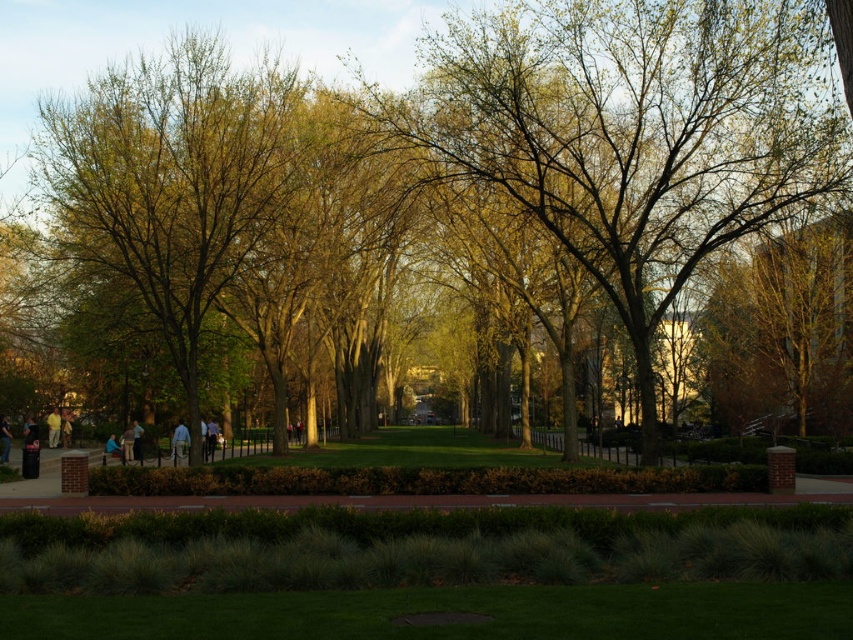
Question: Among these points, which one is farthest from the camera?

Choices:
 (A) (27, 436)
 (B) (77, 176)

Answer: (B)

Question: Does green leafy tree at center have a smaller size compared to dark blue jeans at lower left?

Choices:
 (A) no
 (B) yes

Answer: (A)

Question: Is green leafy tree at left wider than yellow cotton shirt at lower left?

Choices:
 (A) yes
 (B) no

Answer: (A)

Question: Does green leafy tree at left appear over red brick path at center?

Choices:
 (A) yes
 (B) no

Answer: (A)

Question: Which object appears farthest from the camera in this image?

Choices:
 (A) dark blue jeans at lower left
 (B) green leafy tree at left
 (C) green leafy tree at center

Answer: (A)

Question: Among these points, which one is nearest to the camera?

Choices:
 (A) (543, 496)
 (B) (520, 141)

Answer: (A)